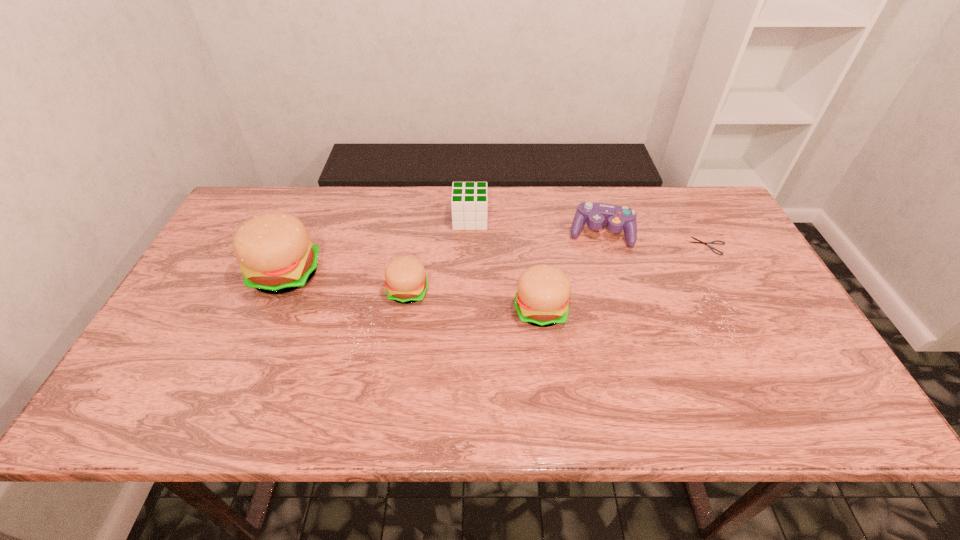
This screenshot has height=540, width=960. In the image, there is a desktop. Find the location of `vacant space at the far edge`. vacant space at the far edge is located at coordinates (575, 204).

In the image, there is a desktop. At what (x,y) coordinates should I click in order to perform the action: click on vacant region at the near edge. Please return your answer as a coordinate pair (x, y). The width and height of the screenshot is (960, 540). Looking at the image, I should click on (502, 368).

The width and height of the screenshot is (960, 540). In the image, there is a desktop. In order to click on vacant space at the left edge in this screenshot , I will do `click(195, 291)`.

Locate an element on the screen. This screenshot has width=960, height=540. free space at the right edge of the desktop is located at coordinates (695, 248).

This screenshot has width=960, height=540. In the image, there is a desktop. Identify the location of free region at the far left corner. (257, 193).

At what (x,y) coordinates should I click in order to perform the action: click on empty space that is in between the fourth object from right to left and the shears. Please return your answer as a coordinate pair (x, y). This screenshot has height=540, width=960. Looking at the image, I should click on (589, 233).

You are a GUI agent. You are given a task and a screenshot of the screen. Output one action in this format:
    pyautogui.click(x=<x>, y=<y>)
    Task: Click on the free space between the third object from right to left and the fifth object from left to right
    The image size is (960, 540).
    Given the screenshot: What is the action you would take?
    pyautogui.click(x=570, y=272)

Image resolution: width=960 pixels, height=540 pixels. Identify the location of free space between the fifth object from left to right and the rightmost hamburger. (570, 272).

The width and height of the screenshot is (960, 540). Identify the location of vacant area between the control and the fourth object from right to left. (536, 226).

Locate an element on the screen. The width and height of the screenshot is (960, 540). vacant space that's between the fourth object from right to left and the second hamburger from right to left is located at coordinates (439, 255).